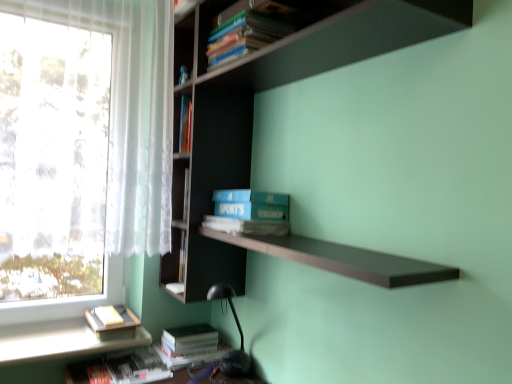
The image size is (512, 384). I want to click on blank space above hardcover book at lower left, the 3th book from the bottom (from a real-world perspective), so click(x=113, y=311).